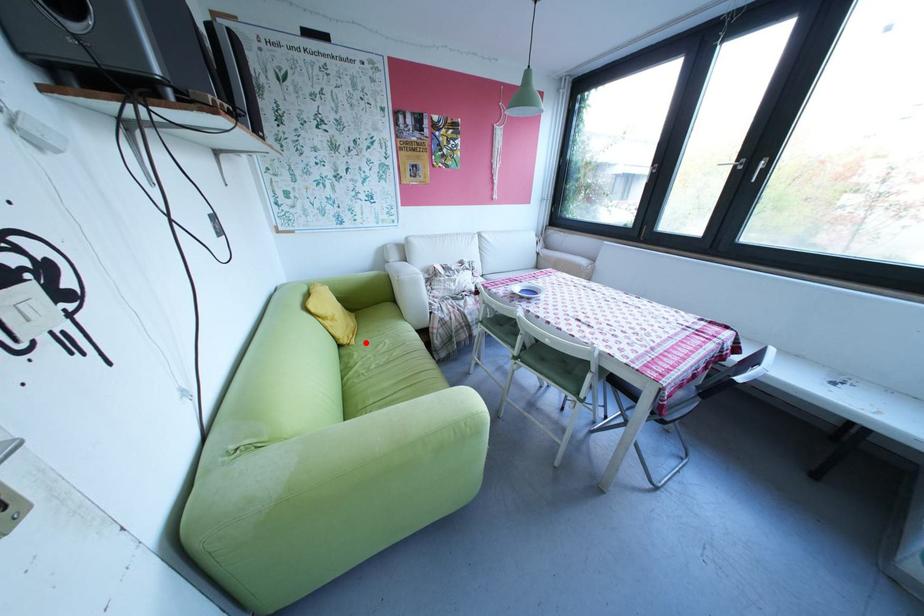
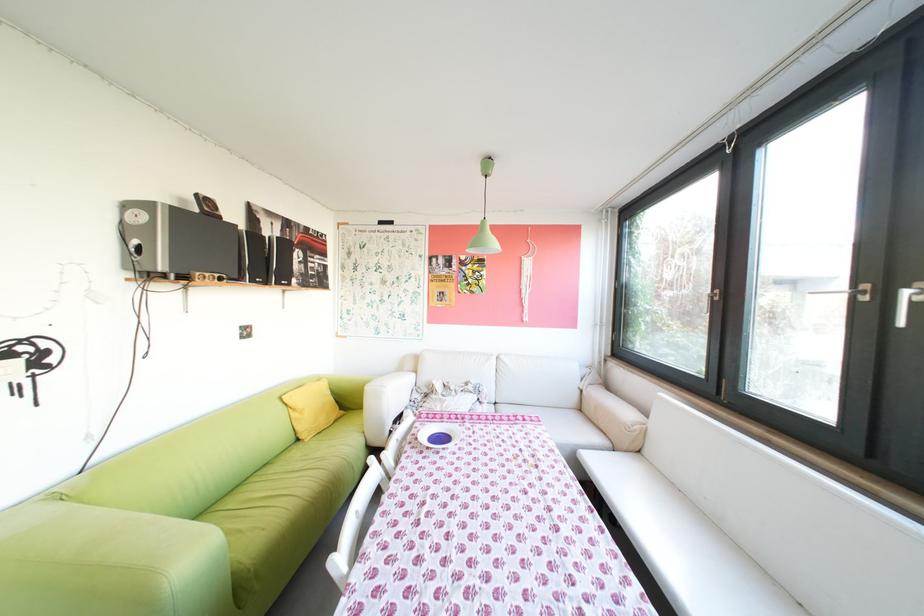
Locate, in the second image, the point that corresponds to the highlighted location in the first image.

(321, 440)